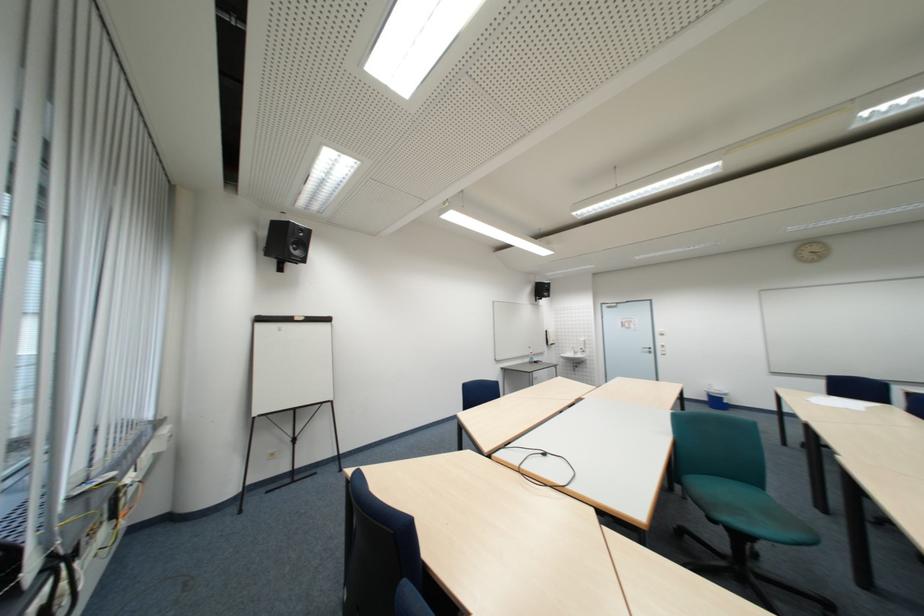
I want to click on faucet handle, so click(x=581, y=349).